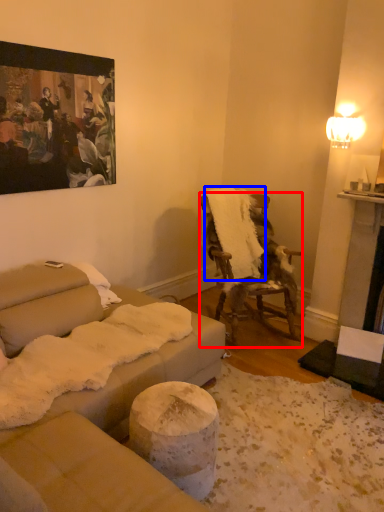
Question: Which of the following is the farthest to the observer, chair (highlighted by a red box) or blanket (highlighted by a blue box)?

Choices:
 (A) chair
 (B) blanket

Answer: (B)